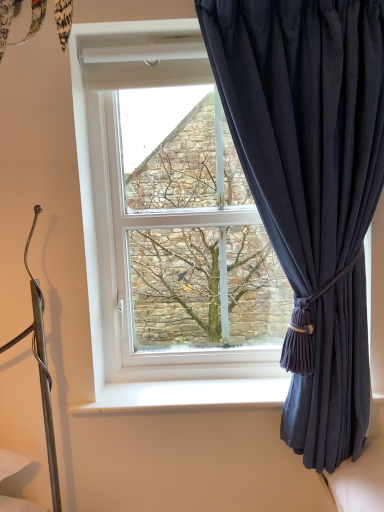
Locate an element on the screen. The image size is (384, 512). blank space above white plastic window sill at lower center (from a real-world perspective) is located at coordinates (196, 388).